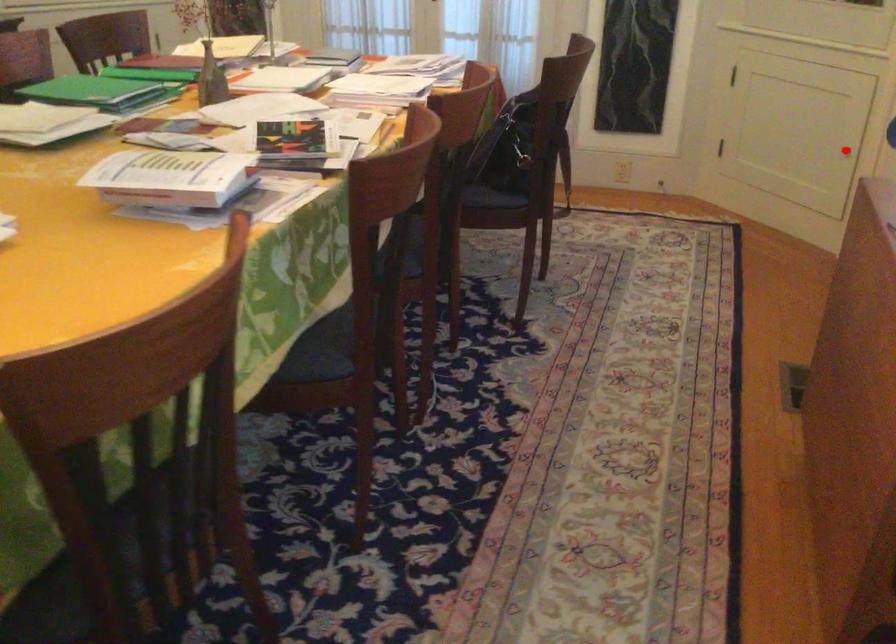
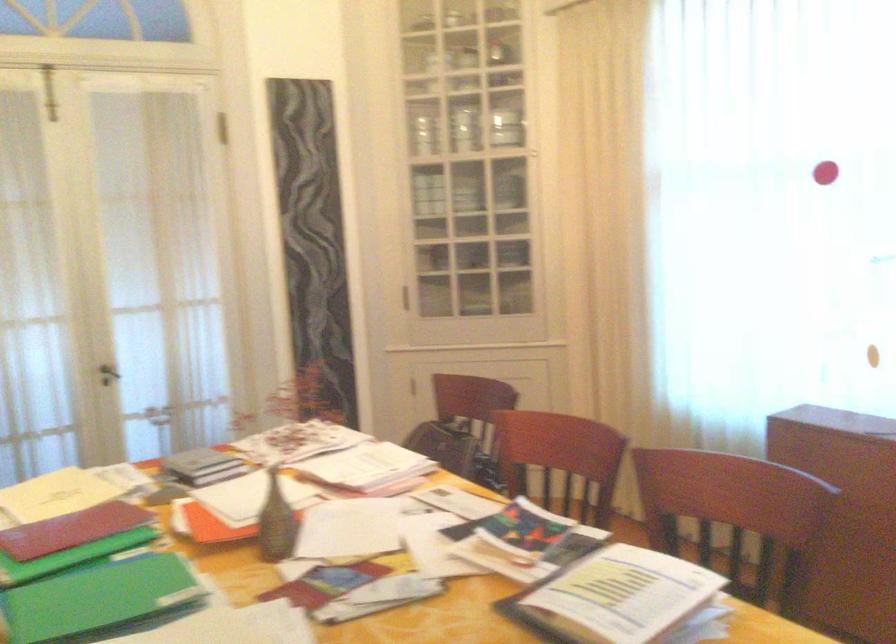
Question: I am providing you with two images of the same scene from different viewpoints. A red point is marked on the first image. Can you still see the location of the red point in image 2?

Choices:
 (A) Yes
 (B) No

Answer: (B)